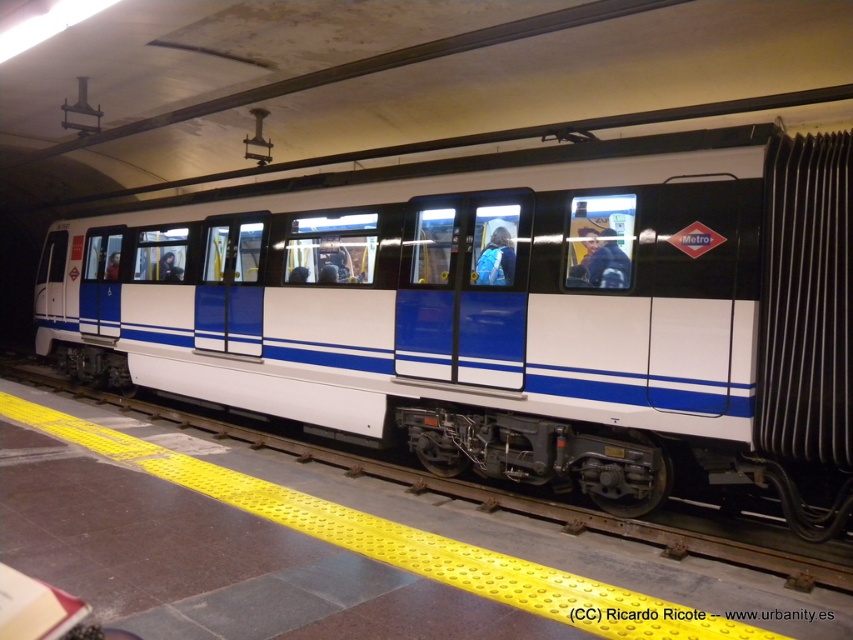
From the picture: You are standing on the subway platform and want to board the white glossy train at center. Based on its location, where should you position yourself relative to the yellow tactile paving strip to ensure you are in the correct boarding area?

Since the white glossy train at center is located at point (506, 314), you should position yourself directly above the yellow tactile paving strip to align with the train doors, ensuring safe boarding.

You are a passenger waiting on the subway platform. You see a matte blue jacket at center and a blue fabric backpack at center. Which item is larger in size?

The matte blue jacket at center is bigger than the blue fabric backpack at center.